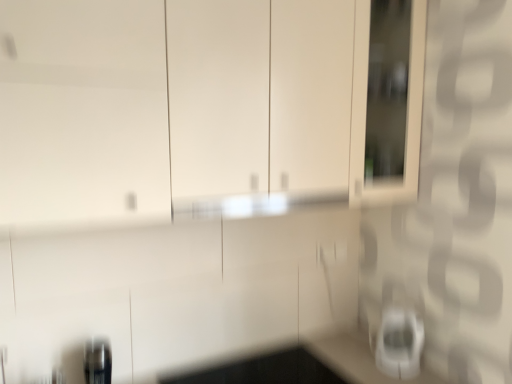
Question: From a real-world perspective, is white glossy coffee maker at lower right physically above black glossy counter top at lower center?

Choices:
 (A) yes
 (B) no

Answer: (A)

Question: Is white glossy coffee maker at lower right outside black glossy counter top at lower center?

Choices:
 (A) no
 (B) yes

Answer: (B)

Question: From the image's perspective, is white glossy coffee maker at lower right under black glossy counter top at lower center?

Choices:
 (A) no
 (B) yes

Answer: (A)

Question: Is white glossy coffee maker at lower right closer to camera compared to black glossy counter top at lower center?

Choices:
 (A) yes
 (B) no

Answer: (B)

Question: Is white glossy coffee maker at lower right looking in the opposite direction of black glossy counter top at lower center?

Choices:
 (A) yes
 (B) no

Answer: (B)

Question: Would you say white glossy coffee maker at lower right contains black glossy counter top at lower center?

Choices:
 (A) no
 (B) yes

Answer: (A)

Question: From the image's perspective, would you say black glossy counter top at lower center is shown under white glossy coffee maker at lower right?

Choices:
 (A) no
 (B) yes

Answer: (B)

Question: Is black glossy counter top at lower center at the right side of white glossy coffee maker at lower right?

Choices:
 (A) yes
 (B) no

Answer: (B)

Question: Is black glossy counter top at lower center placed right next to white glossy coffee maker at lower right?

Choices:
 (A) no
 (B) yes

Answer: (A)

Question: Is black glossy counter top at lower center not within white glossy coffee maker at lower right?

Choices:
 (A) no
 (B) yes

Answer: (B)

Question: Can white glossy coffee maker at lower right be found inside black glossy counter top at lower center?

Choices:
 (A) yes
 (B) no

Answer: (B)

Question: From the image's perspective, is black glossy counter top at lower center on white glossy coffee maker at lower right?

Choices:
 (A) yes
 (B) no

Answer: (B)

Question: Considering the relative positions of white glossy coffee maker at lower right and black glossy counter top at lower center in the image provided, is white glossy coffee maker at lower right to the left or to the right of black glossy counter top at lower center?

Choices:
 (A) left
 (B) right

Answer: (B)